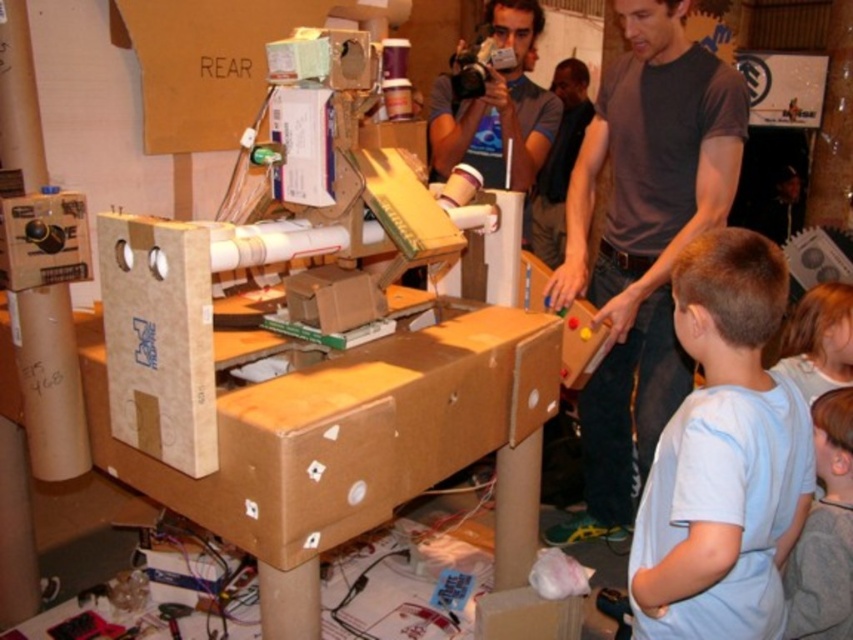
Question: Can you confirm if matte blue shirt at upper center is positioned to the left of light brown hair at upper right?

Choices:
 (A) no
 (B) yes

Answer: (B)

Question: Which is farther from the light blue shirt at lower right?

Choices:
 (A) matte blue shirt at upper center
 (B) dark gray t-shirt at center

Answer: (A)

Question: Is light blue cotton shirt at lower right smaller than matte blue shirt at upper center?

Choices:
 (A) no
 (B) yes

Answer: (B)

Question: Observing the image, what is the correct spatial positioning of matte blue shirt at upper center in reference to light brown hair at upper right?

Choices:
 (A) left
 (B) right

Answer: (A)

Question: Which object appears farthest from the camera in this image?

Choices:
 (A) light brown hair at upper right
 (B) light blue cotton shirt at lower right

Answer: (A)

Question: Considering the real-world distances, which object is farthest from the light blue shirt at lower right?

Choices:
 (A) matte blue shirt at upper center
 (B) dark gray t-shirt at center

Answer: (A)